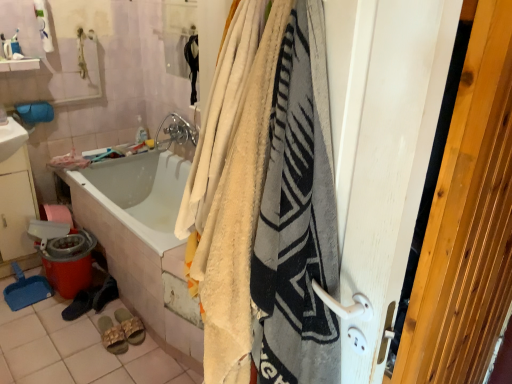
Question: From a real-world perspective, relative to black suede shoes at lower left, which ranks as the 2th footwear in left-to-right order, is white glossy sink at lower left, placed as the 1th sink when sorted from bottom to top, vertically above or below?

Choices:
 (A) above
 (B) below

Answer: (A)

Question: In terms of height, does white glossy sink at lower left, placed as the 1th sink when sorted from bottom to top, look taller or shorter compared to black suede shoes at lower left, which ranks as the 2th footwear in left-to-right order?

Choices:
 (A) short
 (B) tall

Answer: (B)

Question: Which of these objects is positioned farthest from the white glossy bathtub at lower left?

Choices:
 (A) white wood screen door at right
 (B) black suede shoes at lower left, which is counted as the third footwear, starting from the right
 (C) beige fabric slipper at lower center, the fourth footwear in the left-to-right sequence
 (D) white tile at lower left
 (E) chrome metallic faucet at upper center

Answer: (A)

Question: Which object is the farthest from the white glossy sink at lower left, placed as the 1th sink when sorted from bottom to top?

Choices:
 (A) gold fabric slippers at lower center, acting as the 2th footwear starting from the right
 (B) black suede shoes at lower left, which is counted as the third footwear, starting from the right
 (C) chrome metallic faucet at upper center
 (D) soft cotton blanket at center
 (E) white plastic soap at upper center

Answer: (D)